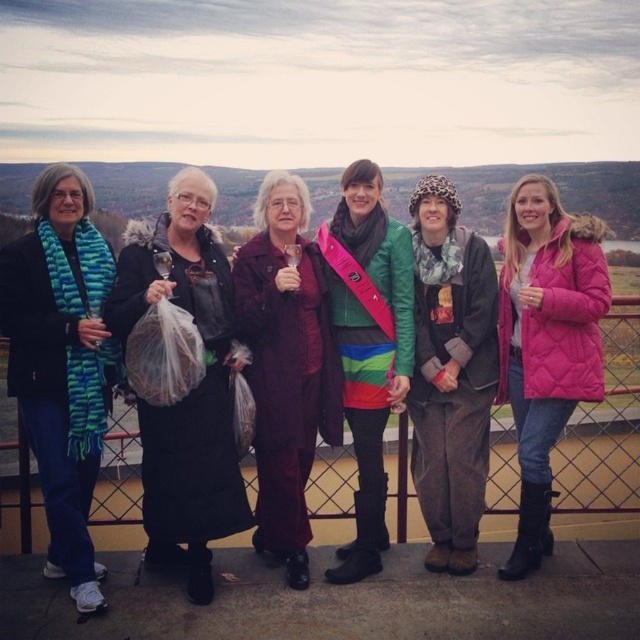
Question: Can you confirm if pink quilted jacket at right is smaller than velvet maroon dress at center?

Choices:
 (A) yes
 (B) no

Answer: (A)

Question: Estimate the real-world distances between objects in this image. Which object is farther from the velvet maroon dress at center?

Choices:
 (A) leopard print scarf at center
 (B) multicolored striped skirt at center

Answer: (A)

Question: Which of the following is the closest to the observer?

Choices:
 (A) (44, 236)
 (B) (547, 417)

Answer: (A)

Question: Can you confirm if leopard print scarf at center is smaller than multicolored striped skirt at center?

Choices:
 (A) no
 (B) yes

Answer: (B)

Question: Which object is the farthest from the pink quilted jacket at right?

Choices:
 (A) leopard print scarf at center
 (B) velvet maroon dress at center

Answer: (B)

Question: In this image, where is pink quilted jacket at right located relative to velvet maroon dress at center?

Choices:
 (A) left
 (B) right

Answer: (B)